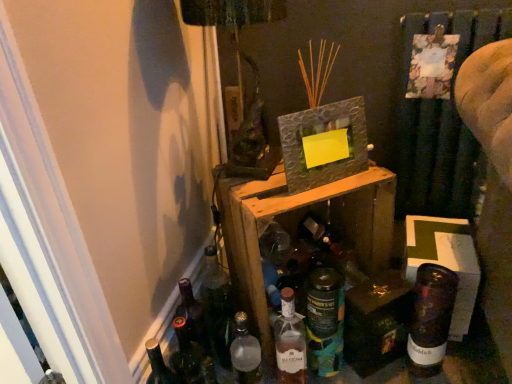
Question: Is cardboard box at lower right to the right of matte glass bottle at center, which is the 3th bottle from right to left, from the viewer's perspective?

Choices:
 (A) yes
 (B) no

Answer: (A)

Question: Does cardboard box at lower right have a smaller size compared to matte glass bottle at center, which is the second bottle in left-to-right order?

Choices:
 (A) yes
 (B) no

Answer: (B)

Question: Is cardboard box at lower right taller than matte glass bottle at center, which is the second bottle in left-to-right order?

Choices:
 (A) yes
 (B) no

Answer: (B)

Question: Can matte glass bottle at center, which is the 3th bottle from right to left, be found inside cardboard box at lower right?

Choices:
 (A) yes
 (B) no

Answer: (B)

Question: From a real-world perspective, is cardboard box at lower right under matte glass bottle at center, which is the second bottle in left-to-right order?

Choices:
 (A) no
 (B) yes

Answer: (B)

Question: Can you confirm if cardboard box at lower right is thinner than matte glass bottle at center, which is the 3th bottle from right to left?

Choices:
 (A) no
 (B) yes

Answer: (A)

Question: Can you confirm if cardboard box at lower right is taller than shiny dark brown bottle at lower right, the first bottle in the right-to-left sequence?

Choices:
 (A) no
 (B) yes

Answer: (A)

Question: Could you tell me if cardboard box at lower right is facing shiny dark brown bottle at lower right, the first bottle in the right-to-left sequence?

Choices:
 (A) no
 (B) yes

Answer: (B)

Question: Is cardboard box at lower right to the right of shiny dark brown bottle at lower right, marked as the 4th bottle in a left-to-right arrangement, from the viewer's perspective?

Choices:
 (A) yes
 (B) no

Answer: (A)

Question: From a real-world perspective, is cardboard box at lower right below shiny dark brown bottle at lower right, the first bottle in the right-to-left sequence?

Choices:
 (A) no
 (B) yes

Answer: (B)

Question: From a real-world perspective, is cardboard box at lower right physically above shiny dark brown bottle at lower right, marked as the 4th bottle in a left-to-right arrangement?

Choices:
 (A) yes
 (B) no

Answer: (B)

Question: Is cardboard box at lower right to the left of shiny dark brown bottle at lower right, marked as the 4th bottle in a left-to-right arrangement, from the viewer's perspective?

Choices:
 (A) no
 (B) yes

Answer: (A)

Question: From the image's perspective, is textured gray picture frame at upper center under shiny dark brown bottle at lower right, the first bottle in the right-to-left sequence?

Choices:
 (A) no
 (B) yes

Answer: (A)